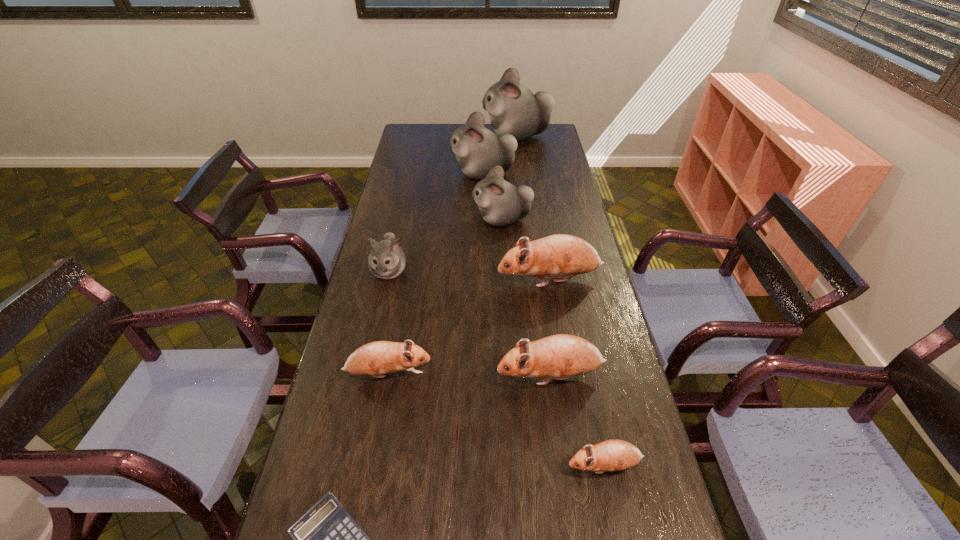
Where is `free space located on the face of the second smallest white hamster`? free space located on the face of the second smallest white hamster is located at coordinates (x=435, y=220).

At what (x,y) coordinates should I click in order to perform the action: click on vacant space located on the face of the second smallest white hamster. Please return your answer as a coordinate pair (x, y). This screenshot has width=960, height=540. Looking at the image, I should click on (379, 220).

At what (x,y) coordinates should I click in order to perform the action: click on vacant space located on the face of the second smallest white hamster. Please return your answer as a coordinate pair (x, y). The width and height of the screenshot is (960, 540). Looking at the image, I should click on (397, 220).

This screenshot has width=960, height=540. In order to click on free space located at the face of the biggest brown hamster in this screenshot , I will do `click(482, 280)`.

What are the coordinates of `free space located 0.070m at the face of the biggest brown hamster` in the screenshot? It's located at (476, 280).

The width and height of the screenshot is (960, 540). I want to click on vacant position located at the face of the biggest brown hamster, so coord(436,280).

The width and height of the screenshot is (960, 540). What are the coordinates of `vacant space located 0.060m on the face of the smallest white hamster` in the screenshot? It's located at (382, 302).

Locate an element on the screen. free region located 0.380m at the face of the third smallest brown hamster is located at coordinates (360, 376).

Locate an element on the screen. The image size is (960, 540). blank space located 0.380m at the face of the third smallest brown hamster is located at coordinates (360, 376).

Locate an element on the screen. blank space located at the face of the third smallest brown hamster is located at coordinates (424, 376).